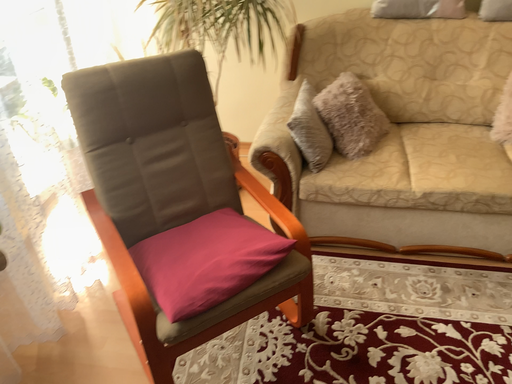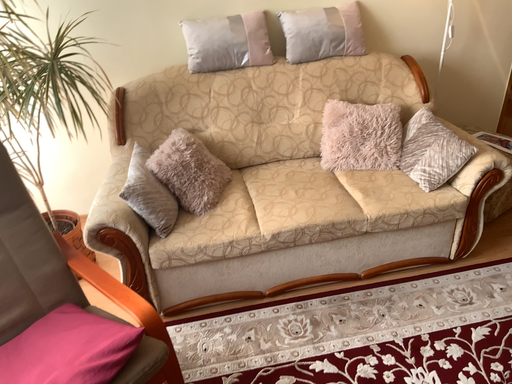
Question: Which way did the camera rotate in the video?

Choices:
 (A) rotated left
 (B) rotated right

Answer: (B)